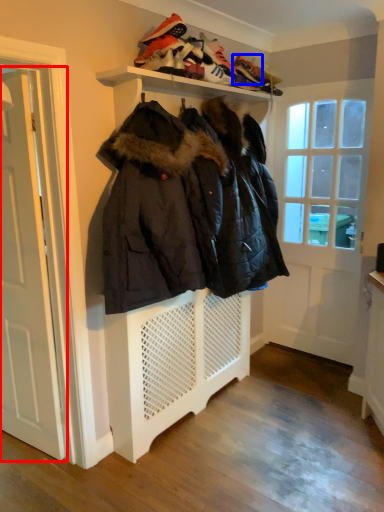
Question: Which object is closer to the camera taking this photo, door (highlighted by a red box) or shoe (highlighted by a blue box)?

Choices:
 (A) door
 (B) shoe

Answer: (A)